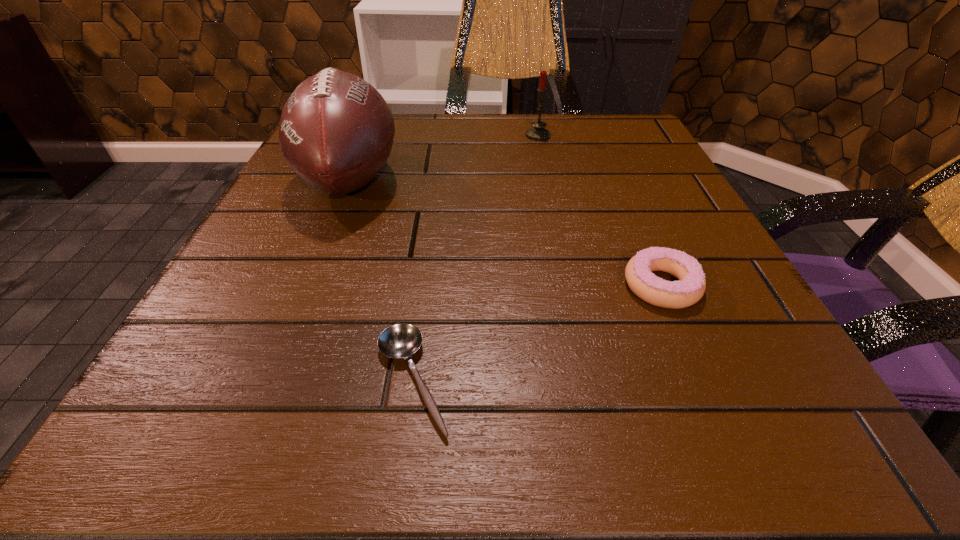
Locate an element on the screen. The image size is (960, 540). the leftmost object is located at coordinates (336, 131).

Image resolution: width=960 pixels, height=540 pixels. What are the coordinates of `football (American)` in the screenshot? It's located at click(336, 131).

Where is `the third shortest object`? the third shortest object is located at coordinates coord(538,133).

Where is `candle`? The image size is (960, 540). candle is located at coordinates (538, 133).

Identify the location of doughnut. Image resolution: width=960 pixels, height=540 pixels. (689, 289).

Find the location of `the third tallest object`. the third tallest object is located at coordinates (689, 289).

This screenshot has width=960, height=540. What are the coordinates of `the nearest object` in the screenshot? It's located at (401, 340).

Find the location of a particular element. ladle is located at coordinates (401, 340).

Identify the location of vacant space located 0.350m on the right of the third nearest object. This screenshot has height=540, width=960. (590, 180).

Find the location of `vacant space positioned 0.220m on the front of the farthest object`. vacant space positioned 0.220m on the front of the farthest object is located at coordinates (552, 199).